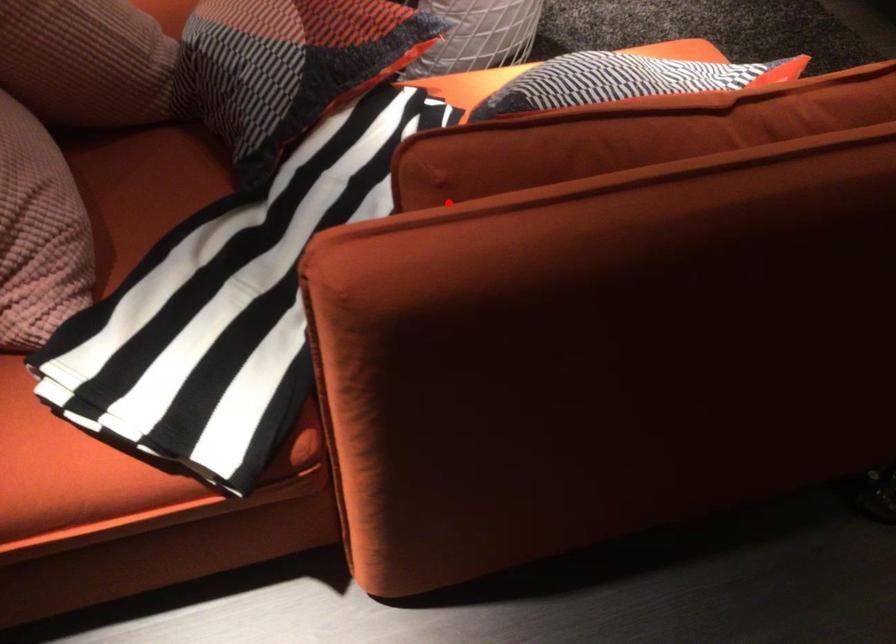
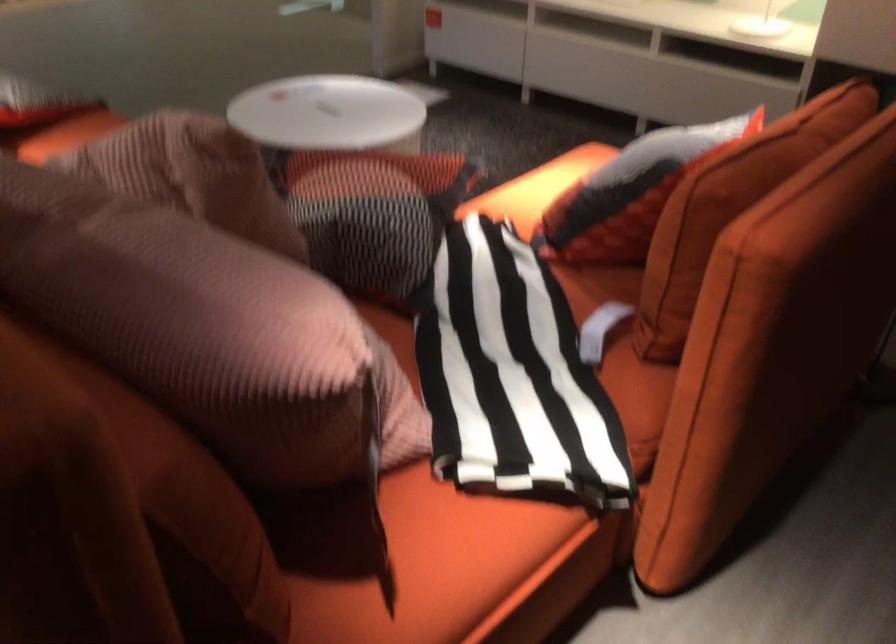
Question: I am providing you with two images of the same scene from different viewpoints. In image1, a red point is highlighted. Considering the same 3D point in image2, which of the following is correct?

Choices:
 (A) It is closer
 (B) It is farther

Answer: (B)